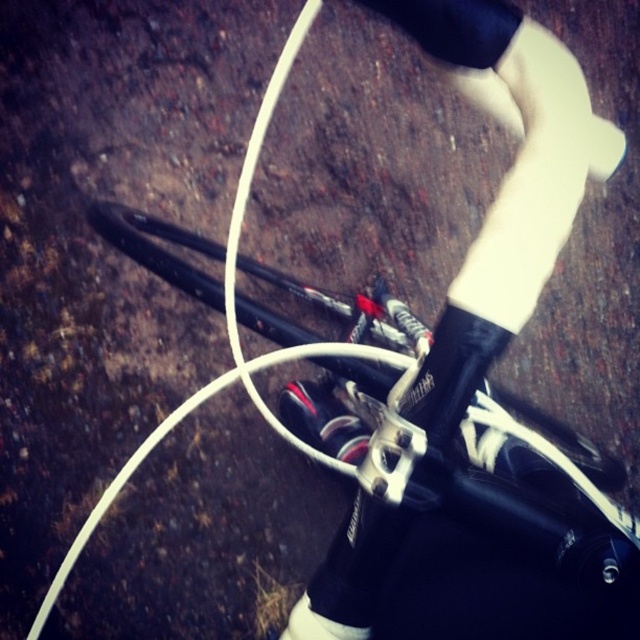
Can you confirm if shiny black shoe at center is smaller than white matte shoe at center?

Incorrect, shiny black shoe at center is not smaller in size than white matte shoe at center.

Can you confirm if shiny black shoe at center is positioned to the right of white matte shoe at center?

In fact, shiny black shoe at center is to the left of white matte shoe at center.

Identify the location of shiny black shoe at center. This screenshot has height=640, width=640. (323, 419).

Where is `shiny black shoe at center`? shiny black shoe at center is located at coordinates (323, 419).